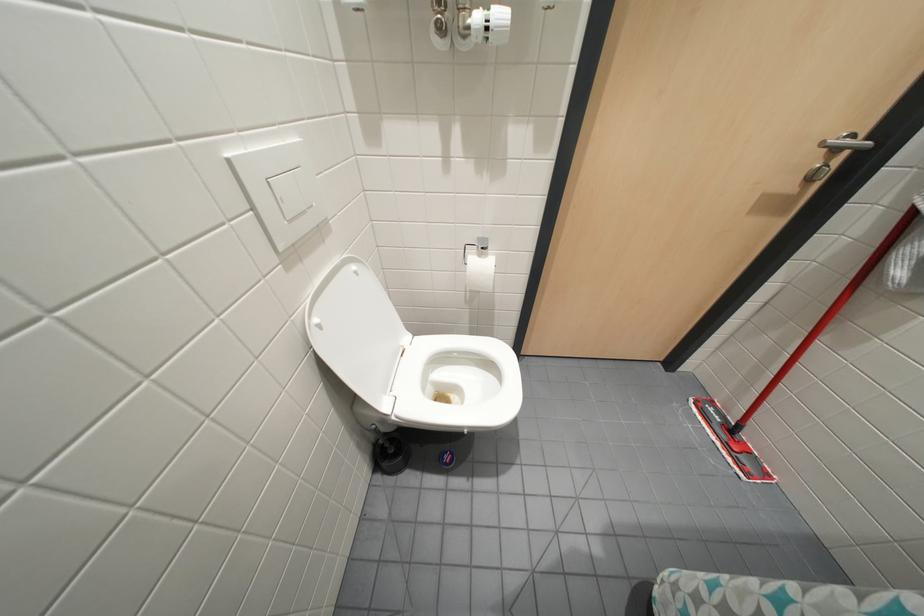
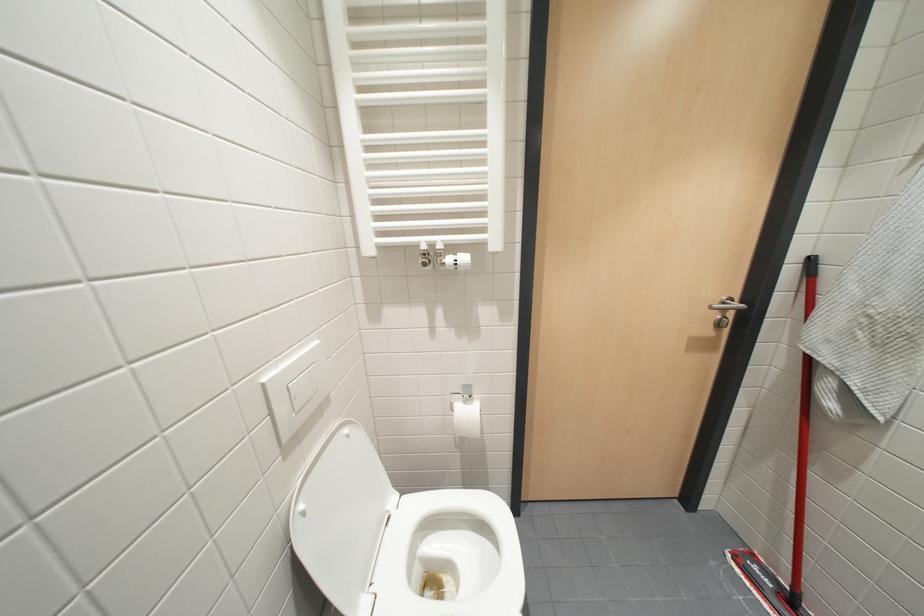
Question: The images are taken continuously from a first-person perspective. In which direction is your viewpoint rotating?

Choices:
 (A) Left
 (B) Right
 (C) Up
 (D) Down

Answer: (C)